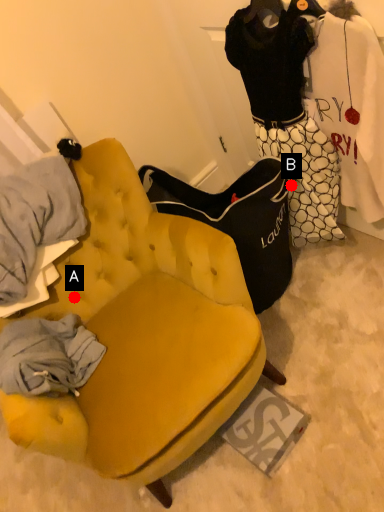
Question: Two points are circled on the image, labeled by A and B beside each circle. Which point is farther from the camera taking this photo?

Choices:
 (A) A is further
 (B) B is further

Answer: (B)